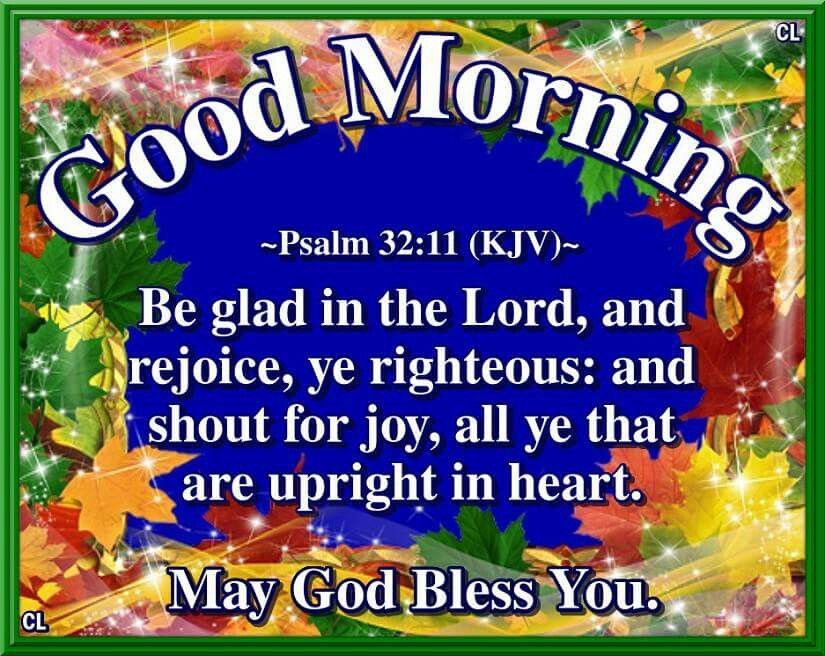
Find the location of a particular element. The width and height of the screenshot is (825, 656). the bottom edge of green frame is located at coordinates (409, 641).